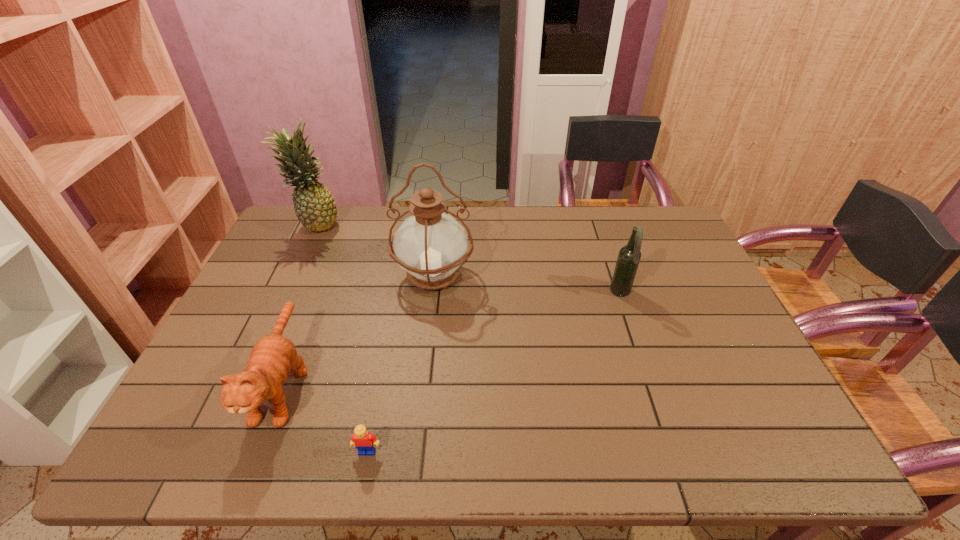
Locate an element on the screen. Image resolution: width=960 pixels, height=540 pixels. vacant space in between the Lego and the oil lamp is located at coordinates (400, 363).

The height and width of the screenshot is (540, 960). What are the coordinates of `free space between the farthest object and the oil lamp` in the screenshot? It's located at (375, 250).

Find the location of a particular element. The image size is (960, 540). free point between the farthest object and the Lego is located at coordinates coord(342,338).

Identify the location of vacant space that's between the fourth tallest object and the farthest object. The width and height of the screenshot is (960, 540). (300, 304).

Locate an element on the screen. This screenshot has height=540, width=960. free point between the second shortest object and the pineapple is located at coordinates (300, 304).

Locate an element on the screen. The image size is (960, 540). vacant space that is in between the second shortest object and the third shortest object is located at coordinates (452, 339).

Locate an element on the screen. Image resolution: width=960 pixels, height=540 pixels. free point between the pineapple and the shortest object is located at coordinates (342, 338).

This screenshot has height=540, width=960. I want to click on free point between the Lego and the oil lamp, so click(400, 363).

The width and height of the screenshot is (960, 540). Find the location of `free point between the pineapple and the beer bottle`. free point between the pineapple and the beer bottle is located at coordinates (468, 259).

Find the location of a particular element. object that is the second closest one to the Lego is located at coordinates (431, 246).